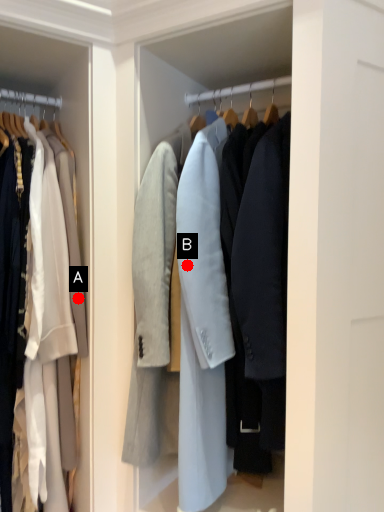
Question: Two points are circled on the image, labeled by A and B beside each circle. Which point is farther from the camera taking this photo?

Choices:
 (A) A is further
 (B) B is further

Answer: (A)